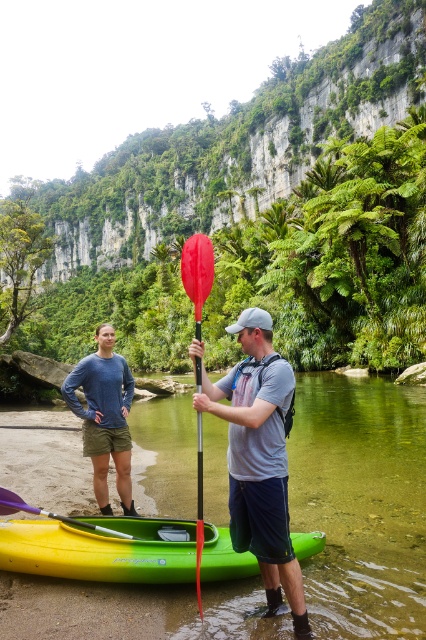
You are a kayaker who wants to reach the red matte paddle at center from the green rubber kayak at lower center. Given that your maximum reach without moving the kayak is 3 meters, can you grab the paddle?

The distance between the green rubber kayak at lower center and the red matte paddle at center is 4.32 meters. Since your maximum reach is 3 meters, you cannot grab the paddle without moving the kayak.